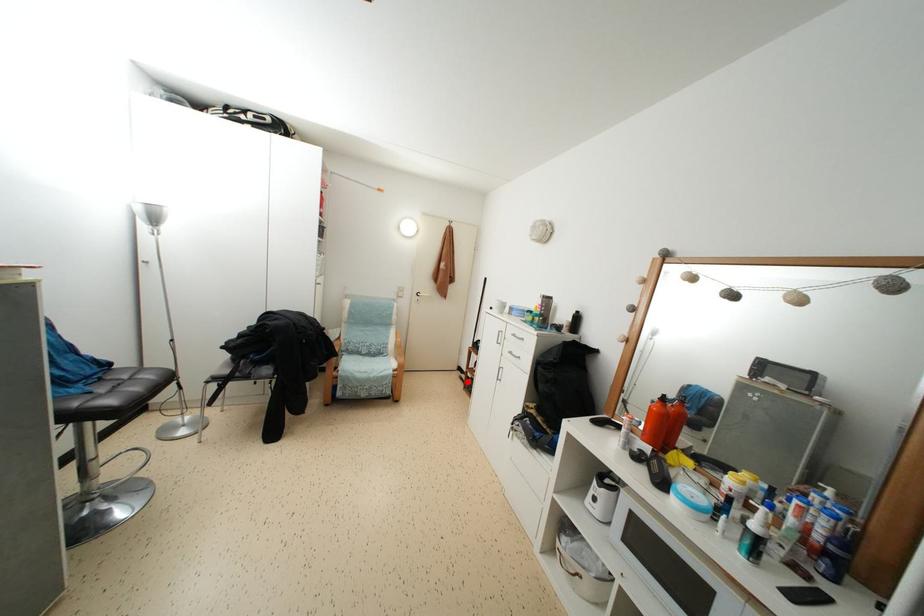
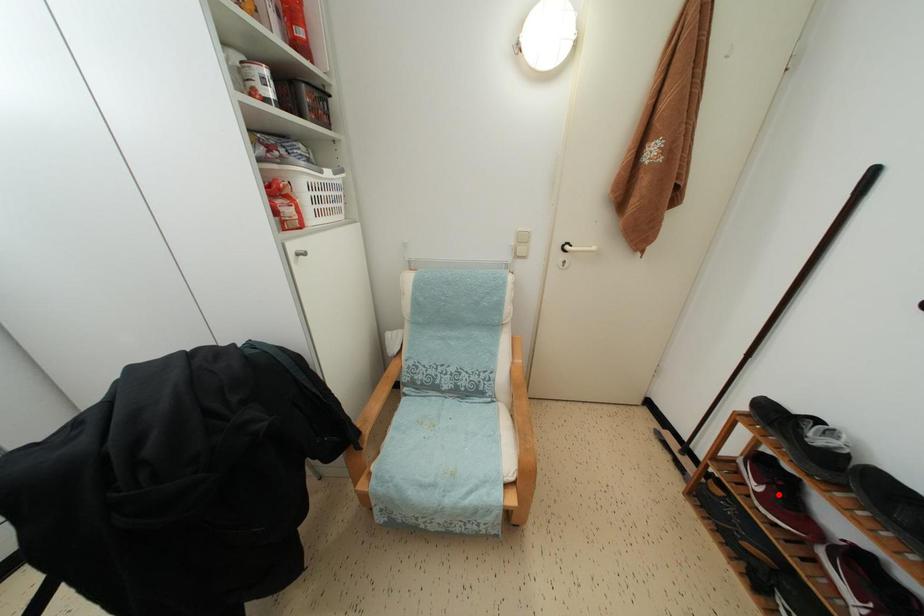
I am providing you with two images of the same scene from different viewpoints. A red point is marked on the first image and another point is marked on the second image. Does the point marked in image1 correspond to the same location as the one in image2?

No